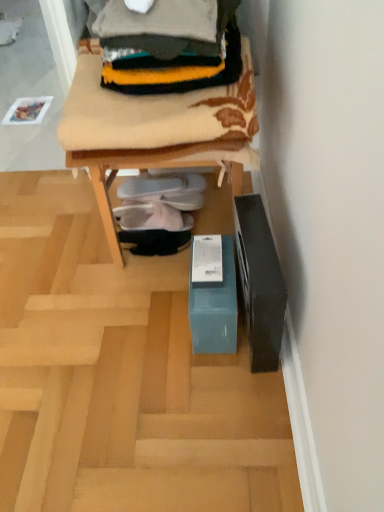
Image resolution: width=384 pixels, height=512 pixels. I want to click on vacant space in front of black suede shoes at center, the first footwear ordered from the bottom, so click(147, 280).